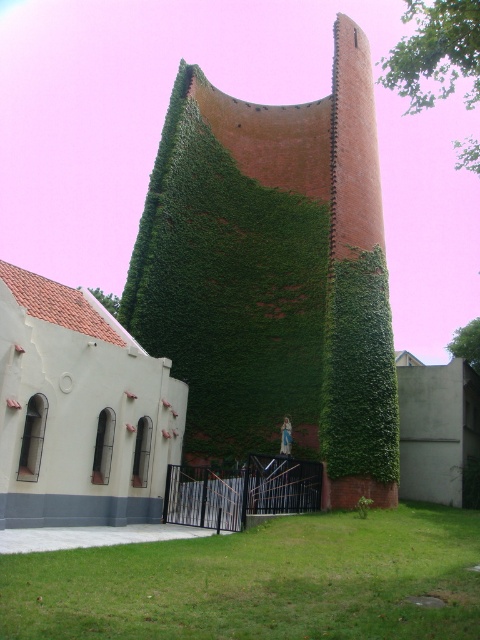
You are standing in front of the modern church or chapel depicted in the image. You notice a point marked at coordinates (268, 284). What does this point represent?

The point at coordinates (268, 284) represents the green ivy covered wall at center.